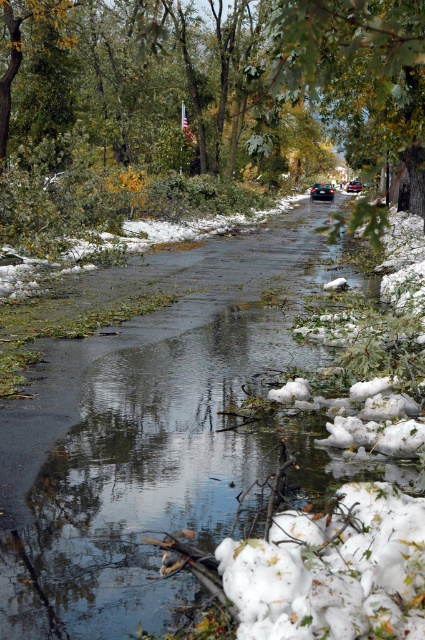
Does black matte car at center appear on the right side of metallic red car at center?

Incorrect, black matte car at center is not on the right side of metallic red car at center.

From the picture: Which is more to the left, black matte car at center or metallic red car at center?

black matte car at center

This screenshot has width=425, height=640. In order to click on black matte car at center in this screenshot , I will do `click(322, 192)`.